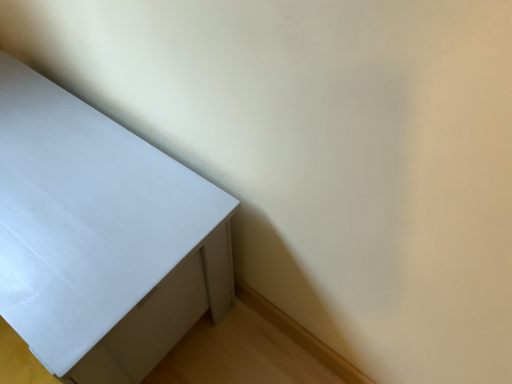
Where is `white matte table at left`? white matte table at left is located at coordinates (101, 237).

What do you see at coordinates (101, 237) in the screenshot? The image size is (512, 384). I see `white matte table at left` at bounding box center [101, 237].

Where is `white matte table at left`? white matte table at left is located at coordinates (101, 237).